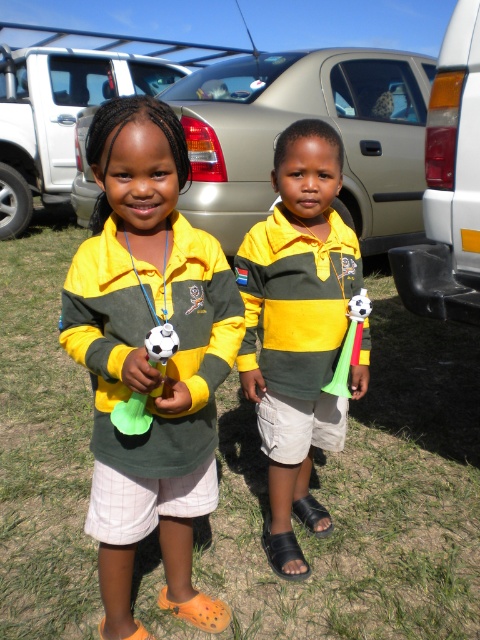
Question: Where is yellow-green striped polo shirt at center located in relation to white plastic soccer ball at right in the image?

Choices:
 (A) below
 (B) above

Answer: (A)

Question: Is matte yellow-green polo shirt at center to the right of white plastic soccer ball at right from the viewer's perspective?

Choices:
 (A) yes
 (B) no

Answer: (B)

Question: Among these objects, which one is farthest from the camera?

Choices:
 (A) white matte soccer ball at left
 (B) matte yellow-green polo shirt at center
 (C) green grass at lower center
 (D) yellow-green striped polo shirt at center

Answer: (D)

Question: Which point is closer to the camera?

Choices:
 (A) yellow-green striped polo shirt at center
 (B) silver metallic car at center

Answer: (A)

Question: Which object appears farthest from the camera in this image?

Choices:
 (A) white plastic soccer ball at right
 (B) yellow-green striped polo shirt at center

Answer: (A)

Question: Is metallic silver car at center bigger than white plastic soccer ball at right?

Choices:
 (A) no
 (B) yes

Answer: (B)